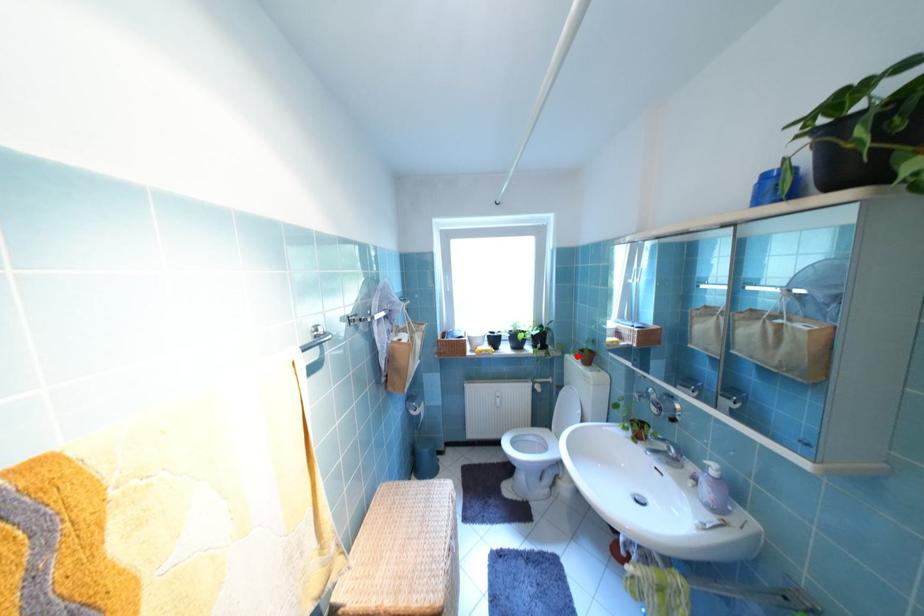
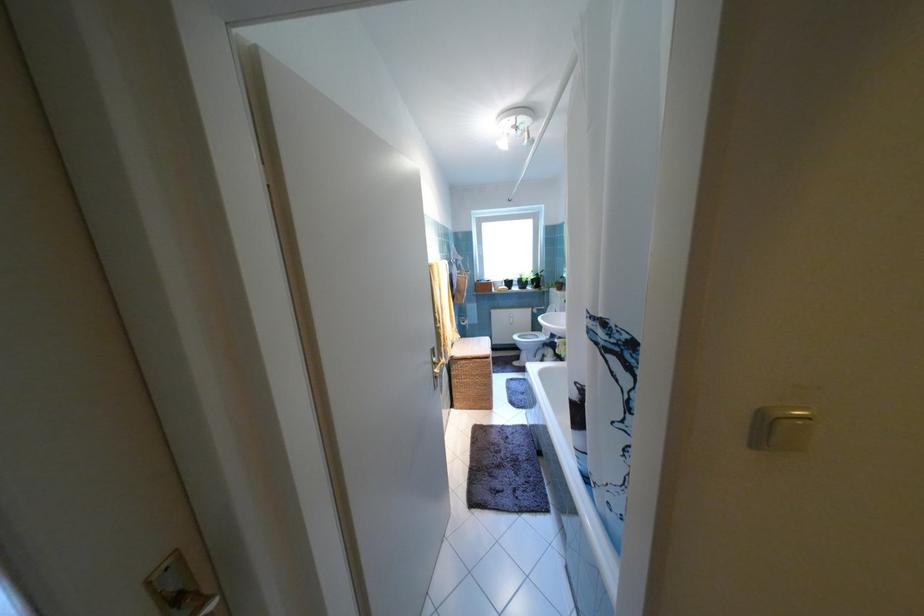
Locate, in the second image, the point that corresponds to the highlighted location in the first image.

(561, 290)